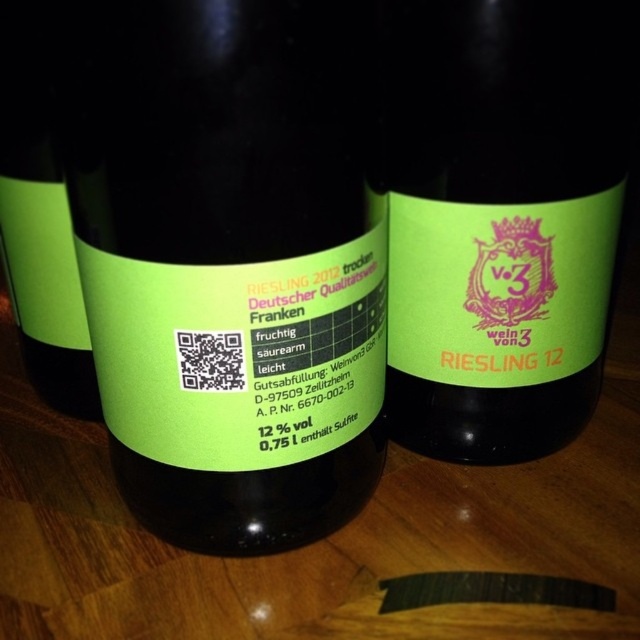
You are arranging wine bottles on a shelf and need to ensure proper spacing between the green matte label at center and the matte green label at center. Which label should you adjust to the right to create space?

The green matte label at center is to the left of matte green label at center, so you should adjust the matte green label at center to the right to create space between them.

Looking at this image, you are a wine connoisseur examining two Riesling bottles on a wooden table. You notice the green matte label at center and the green matte bottle at center. Which object is taller?

The green matte label at center is taller than the green matte bottle at center.